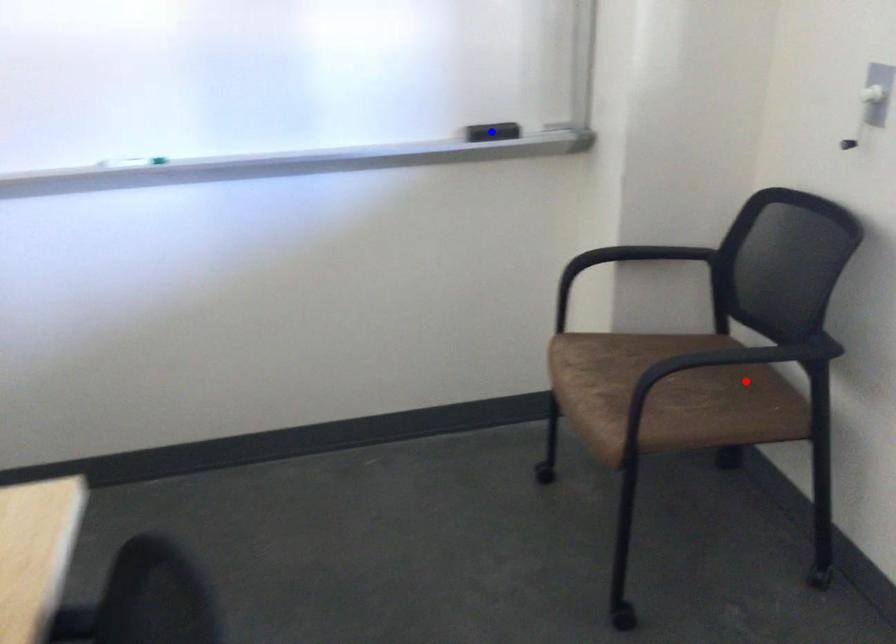
Question: In the image, two points are highlighted. Which point is nearer to the camera? Reply with the corresponding letter.

Choices:
 (A) blue point
 (B) red point

Answer: (B)